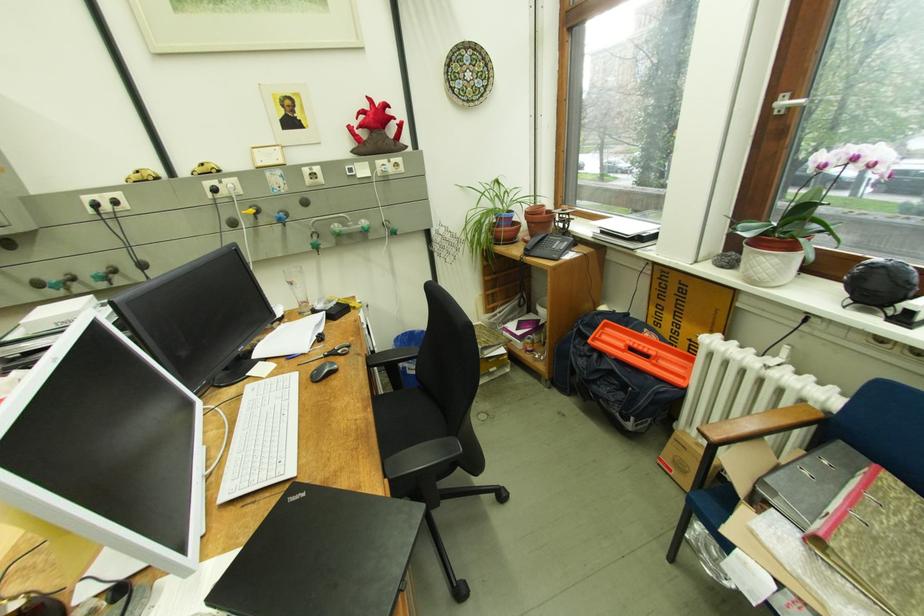
Where would you resting arm the chair armrest? Please return your answer as a coordinate pair (x, y).

(420, 456)